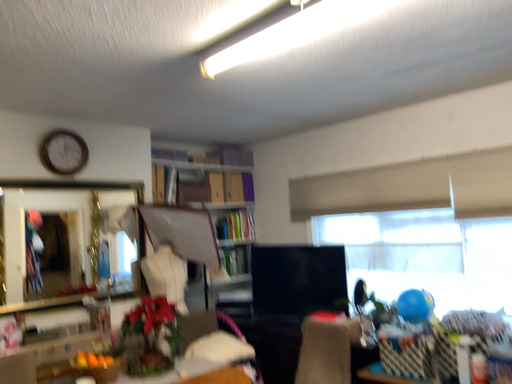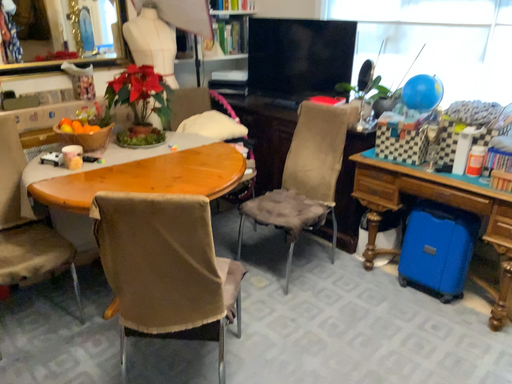
Question: Which way did the camera rotate in the video?

Choices:
 (A) rotated downward
 (B) rotated upward

Answer: (A)